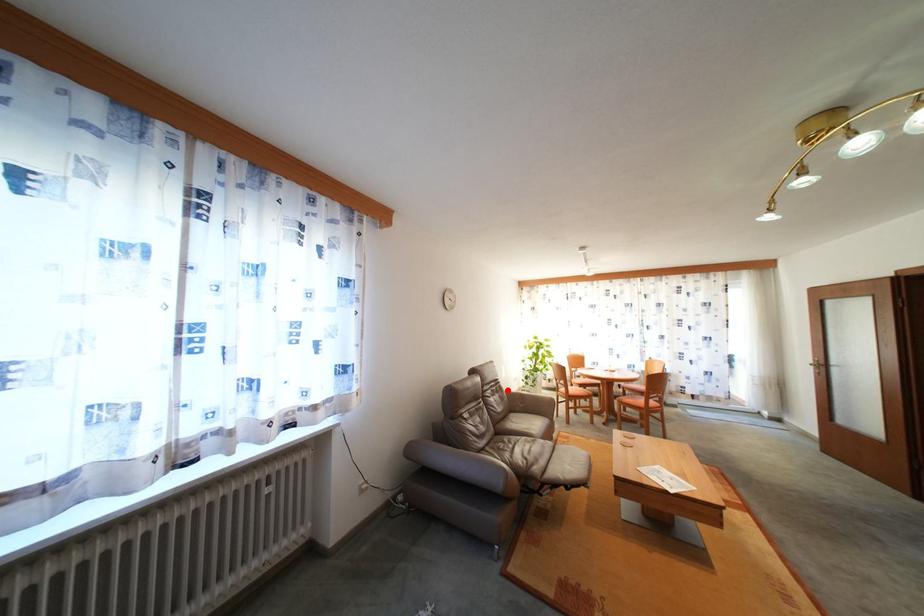
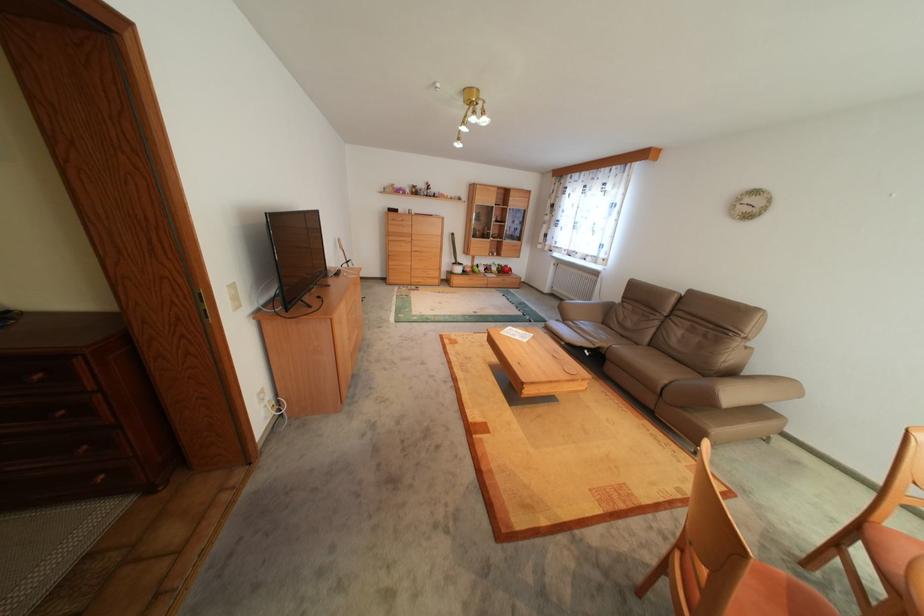
Question: I am providing you with two images of the same scene from different viewpoints. In image1, a red point is highlighted. Considering the same 3D point in image2, which of the following is correct?

Choices:
 (A) It is closer
 (B) It is farther

Answer: (A)